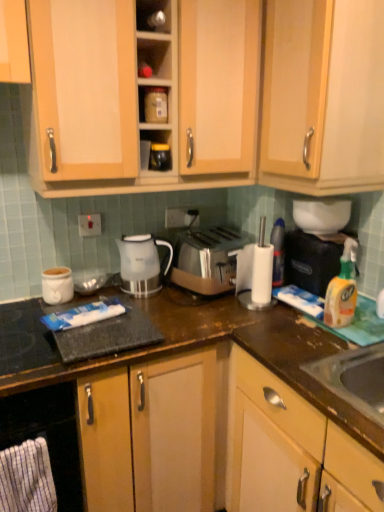
Locate an element on the screen. Image resolution: width=384 pixels, height=512 pixels. vacant area that lies in front of white glossy kettle at center is located at coordinates (159, 305).